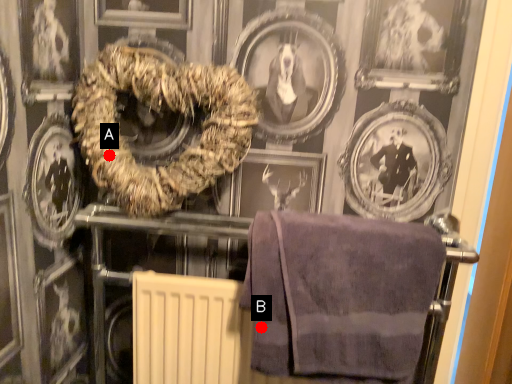
Question: Two points are circled on the image, labeled by A and B beside each circle. Which point is farther from the camera taking this photo?

Choices:
 (A) A is further
 (B) B is further

Answer: (A)